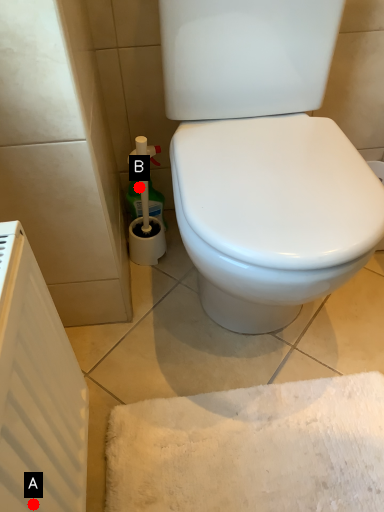
Question: Two points are circled on the image, labeled by A and B beside each circle. Which point appears closest to the camera in this image?

Choices:
 (A) A is closer
 (B) B is closer

Answer: (A)